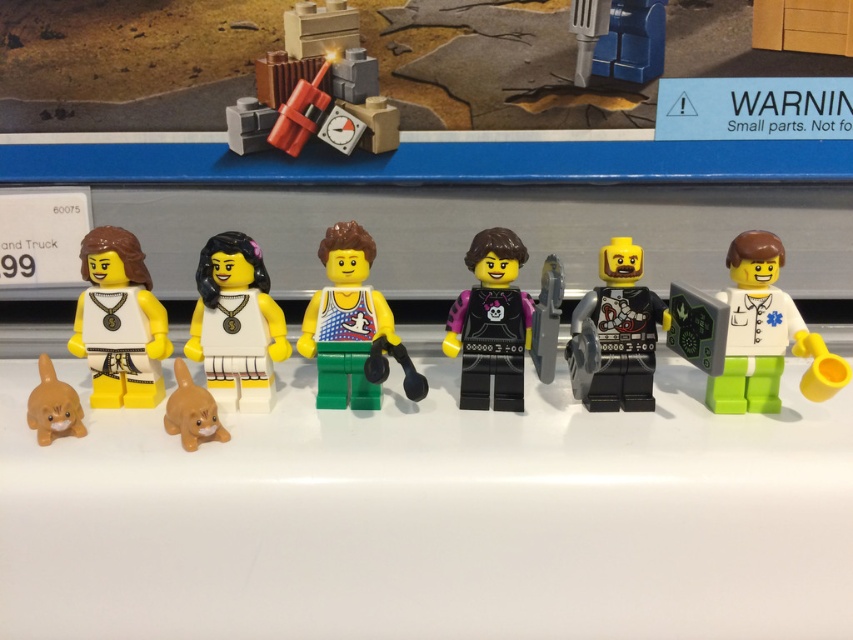
Does point (740, 296) come in front of point (184, 384)?

No, (740, 296) is behind (184, 384).

Can you confirm if white matte doctor at right is wider than orange matte cat at center?

Correct, the width of white matte doctor at right exceeds that of orange matte cat at center.

This screenshot has width=853, height=640. Identify the location of white matte doctor at right. (764, 333).

Is white matte minifigure at left taller than orange matte cat at center?

Yes, white matte minifigure at left is taller than orange matte cat at center.

Between white matte minifigure at left and orange matte cat at center, which one has less height?

Standing shorter between the two is orange matte cat at center.

This screenshot has height=640, width=853. In order to click on white matte minifigure at left in this screenshot , I will do pos(119,321).

Does black matte minifigure at center appear on the left side of matte black vest at center?

Incorrect, black matte minifigure at center is not on the left side of matte black vest at center.

Who is taller, black matte minifigure at center or matte black vest at center?

matte black vest at center

Locate an element on the screen. The height and width of the screenshot is (640, 853). black matte minifigure at center is located at coordinates (614, 333).